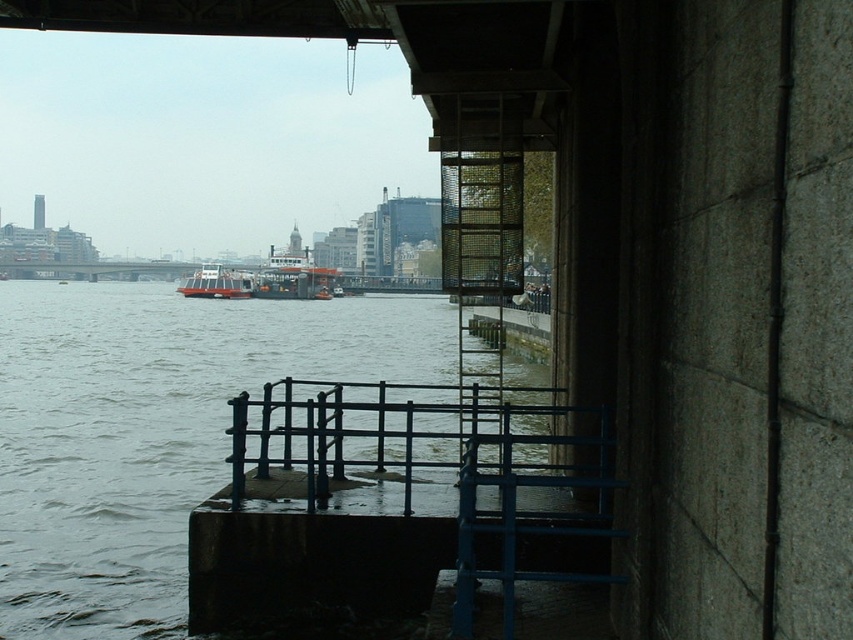
You are standing on the concrete platform under the bridge and want to locate the blue metal rail at center. According to the coordinates provided, where exactly would you find it?

The blue metal rail at center is located at the coordinates point (392, 435).

You are standing on the bridge and want to know the distance to the point marked at coordinates (84, 289). Can you tell me how far that point is from where I am standing?

The point at coordinates (84, 289) is 153.51 meters away from your current position on the bridge.